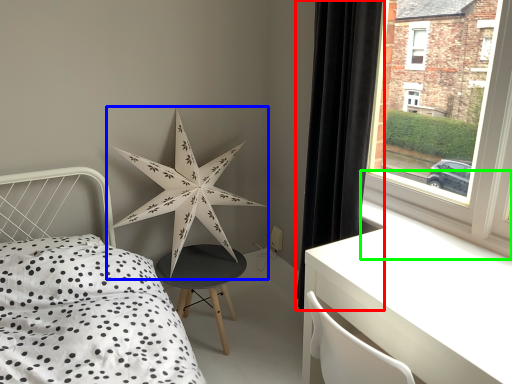
Question: Based on their relative distances, which object is nearer to curtain (highlighted by a red box)? Choose from star (highlighted by a blue box) and window sill (highlighted by a green box).

Choices:
 (A) star
 (B) window sill

Answer: (B)